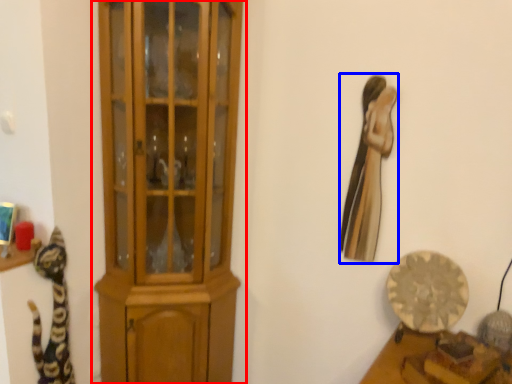
Question: Which of the following is the farthest to the observer, cupboard (highlighted by a red box) or animal (highlighted by a blue box)?

Choices:
 (A) cupboard
 (B) animal

Answer: (B)